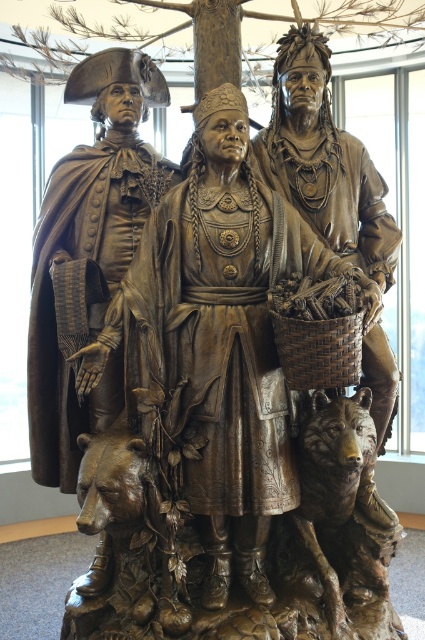
You are an art conservator examining the bronze sculpture. You notice two points of corrosion on the sculpture. One is at point (125, 332) and the other at point (170, 1). Which point is more likely to be on the front side of the sculpture?

Point (125, 332) is closer to the viewer than point (170, 1), so it is more likely to be on the front side of the sculpture.

You are an art conservator assessing the placement of the bronze statue at center and the bronze textured tree trunk at center in the sculpture. Based on their sizes, which object would cast a longer shadow during midday when the sun is directly overhead?

The bronze statue at center has a greater height compared to the bronze textured tree trunk at center, so it would cast a longer shadow during midday when the sun is directly overhead.

You are standing 3 meters away from the sculpture. Can you reach the point at coordinates point (238, 346) without moving closer than 3 meters?

The distance of point (238, 346) from camera is 4.14 meters, so you are currently 3 meters away from the sculpture. Since 4.14 meters is greater than 3 meters, you cannot reach the point at coordinates point (238, 346) without moving closer than 3 meters.